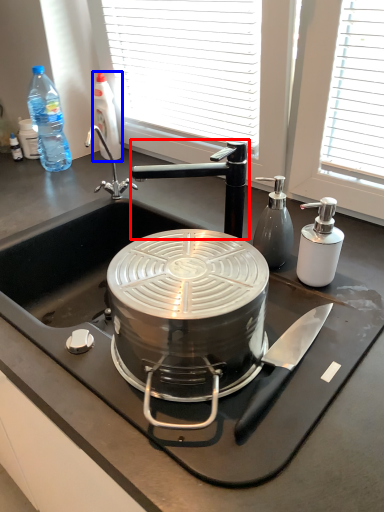
Question: Which point is closer to the camera, tap (highlighted by a red box) or bottle (highlighted by a blue box)?

Choices:
 (A) tap
 (B) bottle

Answer: (A)